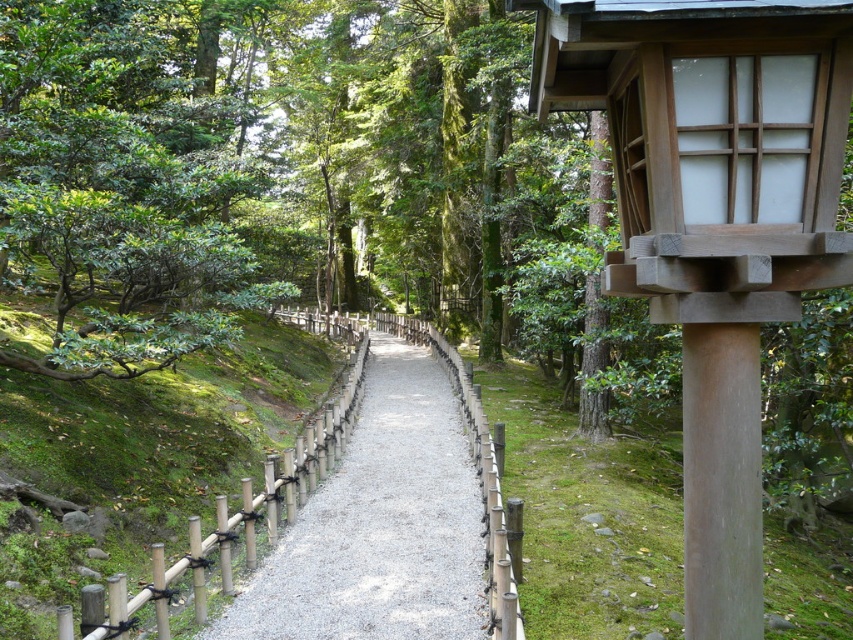
Question: Which object is closer to the camera taking this photo?

Choices:
 (A) gravel at center
 (B) smooth beige pole at right
 (C) green leafy bush at left

Answer: (B)

Question: Is green leafy bush at left closer to camera compared to gravel at center?

Choices:
 (A) no
 (B) yes

Answer: (A)

Question: Among these points, which one is nearest to the camera?

Choices:
 (A) (27, 61)
 (B) (711, 390)

Answer: (B)

Question: Is green leafy bush at left further to the viewer compared to smooth beige pole at right?

Choices:
 (A) no
 (B) yes

Answer: (B)

Question: Which point appears farthest from the camera in this image?

Choices:
 (A) (370, 506)
 (B) (701, 566)

Answer: (A)

Question: Can you confirm if green leafy bush at left is positioned above gravel at center?

Choices:
 (A) yes
 (B) no

Answer: (A)